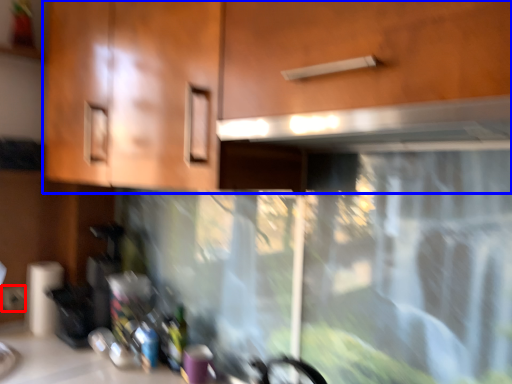
Question: Among these objects, which one is farthest to the camera, electric outlet (highlighted by a red box) or cabinetry (highlighted by a blue box)?

Choices:
 (A) electric outlet
 (B) cabinetry

Answer: (A)